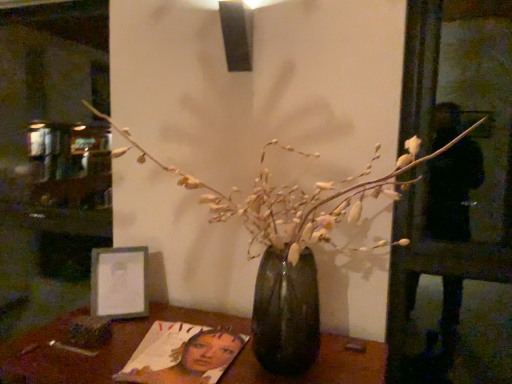
The image size is (512, 384). Describe the element at coordinates (100, 350) in the screenshot. I see `wooden table at center` at that location.

Locate an element on the screen. The width and height of the screenshot is (512, 384). wooden table at center is located at coordinates (100, 350).

Locate an element on the screen. This screenshot has height=384, width=512. matte paper magazine at lower center is located at coordinates (182, 355).

You are a GUI agent. You are given a task and a screenshot of the screen. Output one action in this format:
    pyautogui.click(x=<x>, y=<y>)
    Task: Click on the wooden table at center
    
    Given the screenshot: What is the action you would take?
    [x=100, y=350]

Which object is further away from the camera, matte paper magazine at lower center or metallic silver frame at lower left?

metallic silver frame at lower left is further away from the camera.

Can you see matte paper magazine at lower center touching metallic silver frame at lower left?

matte paper magazine at lower center is not next to metallic silver frame at lower left, and they're not touching.

From a real-world perspective, is matte paper magazine at lower center beneath metallic silver frame at lower left?

Correct, in the physical world, matte paper magazine at lower center is lower than metallic silver frame at lower left.

From a real-world perspective, which is physically above, metallic silver frame at lower left or wooden table at center?

In real-world perspective, metallic silver frame at lower left is above.

Is metallic silver frame at lower left positioned far away from wooden table at center?

They are positioned close to each other.

Does metallic silver frame at lower left appear on the right side of wooden table at center?

No.

Is metallic silver frame at lower left situated inside wooden table at center or outside?

metallic silver frame at lower left is located beyond the bounds of wooden table at center.

Is metallic silver frame at lower left far away from matte paper magazine at lower center?

No.

Does metallic silver frame at lower left appear on the left side of matte paper magazine at lower center?

Correct, you'll find metallic silver frame at lower left to the left of matte paper magazine at lower center.

Could matte paper magazine at lower center be considered to be inside metallic silver frame at lower left?

No, matte paper magazine at lower center is not a part of metallic silver frame at lower left.

Which is further, [134,296] or [417,157]?

Positioned behind is point [134,296].

Is metallic silver frame at lower left situated inside translucent glass vase at center or outside?

metallic silver frame at lower left is located beyond the bounds of translucent glass vase at center.

Is metallic silver frame at lower left far away from translucent glass vase at center?

No, there isn't a large distance between metallic silver frame at lower left and translucent glass vase at center.

Between metallic silver frame at lower left and translucent glass vase at center, which one has more height?

translucent glass vase at center.

Is matte paper magazine at lower center at the back of translucent glass vase at center?

No, translucent glass vase at center is not facing away from matte paper magazine at lower center.

Is the surface of translucent glass vase at center in direct contact with matte paper magazine at lower center?

No.

Does point (341, 190) come closer to viewer compared to point (126, 374)?

Yes, point (341, 190) is in front of point (126, 374).

How far apart are translucent glass vase at center and matte paper magazine at lower center?

translucent glass vase at center and matte paper magazine at lower center are 12.29 inches apart.

Considering the relative sizes of translucent glass vase at center and wooden table at center in the image provided, is translucent glass vase at center taller than wooden table at center?

Indeed, translucent glass vase at center has a greater height compared to wooden table at center.

Considering the positions of objects translucent glass vase at center and wooden table at center in the image provided, who is more to the left, translucent glass vase at center or wooden table at center?

From the viewer's perspective, wooden table at center appears more on the left side.

Which point is more distant from viewer, (313, 323) or (24, 358)?

The point (313, 323) is behind.

Is translucent glass vase at center situated inside wooden table at center or outside?

translucent glass vase at center is not enclosed by wooden table at center.

Is point (350, 188) less distant than point (105, 307)?

Yes, it is.

How different are the orientations of translucent glass vase at center and metallic silver frame at lower left in degrees?

35.5 degrees.

Does translucent glass vase at center have a greater width compared to metallic silver frame at lower left?

Correct, the width of translucent glass vase at center exceeds that of metallic silver frame at lower left.

Can you confirm if translucent glass vase at center is bigger than metallic silver frame at lower left?

Indeed, translucent glass vase at center has a larger size compared to metallic silver frame at lower left.

Locate an element on the screen. The height and width of the screenshot is (384, 512). picture frame that is above the matte paper magazine at lower center (from a real-world perspective) is located at coordinates (119, 282).

The width and height of the screenshot is (512, 384). I want to click on table that appears below the metallic silver frame at lower left (from the image's perspective), so click(100, 350).

When comparing their distances from matte paper magazine at lower center, does wooden table at center or translucent glass vase at center seem closer?

Based on the image, wooden table at center appears to be nearer to matte paper magazine at lower center.

Estimate the real-world distances between objects in this image. Which object is further from metallic silver frame at lower left, wooden table at center or translucent glass vase at center?

translucent glass vase at center is further to metallic silver frame at lower left.

Which object lies nearer to the anchor point metallic silver frame at lower left, translucent glass vase at center or matte paper magazine at lower center?

Among the two, matte paper magazine at lower center is located nearer to metallic silver frame at lower left.

Which object lies further to the anchor point translucent glass vase at center, matte paper magazine at lower center or metallic silver frame at lower left?

metallic silver frame at lower left is positioned further to the anchor translucent glass vase at center.

Considering their positions, is matte paper magazine at lower center positioned closer to wooden table at center than translucent glass vase at center?

The object closer to wooden table at center is matte paper magazine at lower center.

Estimate the real-world distances between objects in this image. Which object is closer to wooden table at center, translucent glass vase at center or metallic silver frame at lower left?

The object closer to wooden table at center is metallic silver frame at lower left.

Based on their spatial positions, is wooden table at center or metallic silver frame at lower left further from translucent glass vase at center?

metallic silver frame at lower left is further to translucent glass vase at center.

When comparing their distances from translucent glass vase at center, does wooden table at center or matte paper magazine at lower center seem further?

wooden table at center is positioned further to the anchor translucent glass vase at center.

Find the location of `table between translucent glass vase at center and metallic silver frame at lower left along the z-axis`. table between translucent glass vase at center and metallic silver frame at lower left along the z-axis is located at coordinates (100, 350).

You are a GUI agent. You are given a task and a screenshot of the screen. Output one action in this format:
    pyautogui.click(x=<x>, y=<y>)
    Task: Click on the woman between translucent glass vase at center and wooden table at center from top to bottom
    
    Given the screenshot: What is the action you would take?
    pyautogui.click(x=182, y=355)

This screenshot has width=512, height=384. Find the location of `woman between wooden table at center and metallic silver frame at lower left from front to back`. woman between wooden table at center and metallic silver frame at lower left from front to back is located at coordinates (182, 355).

Locate an element on the screen. The height and width of the screenshot is (384, 512). woman located between translucent glass vase at center and metallic silver frame at lower left in the depth direction is located at coordinates (182, 355).